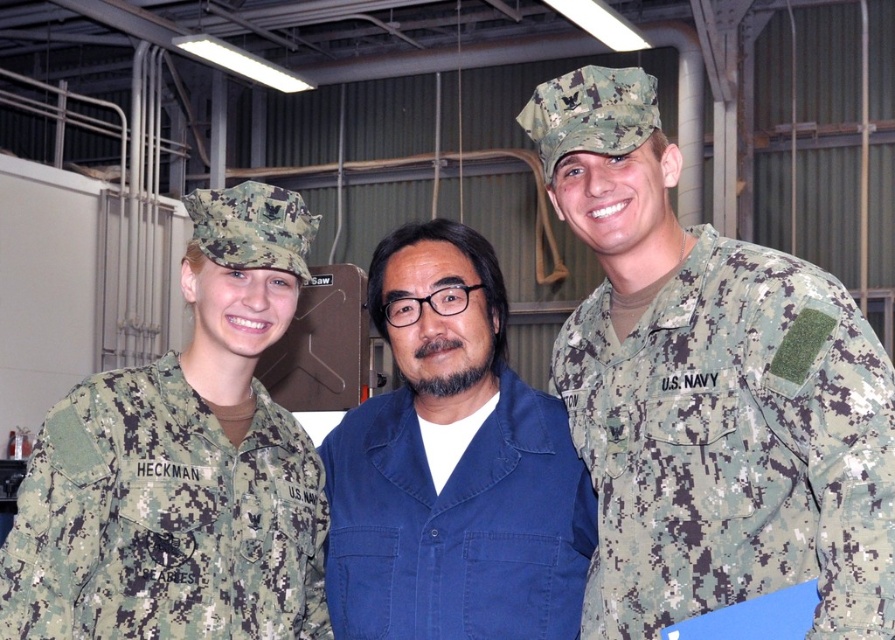
Question: Can you confirm if digital camouflage uniform at left is thinner than blue cotton shirt at center?

Choices:
 (A) no
 (B) yes

Answer: (B)

Question: Is digital camouflage uniform at right thinner than blue cotton shirt at center?

Choices:
 (A) yes
 (B) no

Answer: (A)

Question: Which object is farther from the camera taking this photo?

Choices:
 (A) digital camouflage uniform at left
 (B) digital camouflage uniform at right
 (C) blue cotton shirt at center

Answer: (C)

Question: Does digital camouflage uniform at right have a larger size compared to digital camouflage uniform at left?

Choices:
 (A) no
 (B) yes

Answer: (B)

Question: Which object is farther from the camera taking this photo?

Choices:
 (A) blue cotton shirt at center
 (B) digital camouflage uniform at left
 (C) digital camouflage uniform at right

Answer: (A)

Question: Which object is farther from the camera taking this photo?

Choices:
 (A) digital camouflage uniform at left
 (B) blue cotton shirt at center
 (C) digital camouflage uniform at right

Answer: (B)